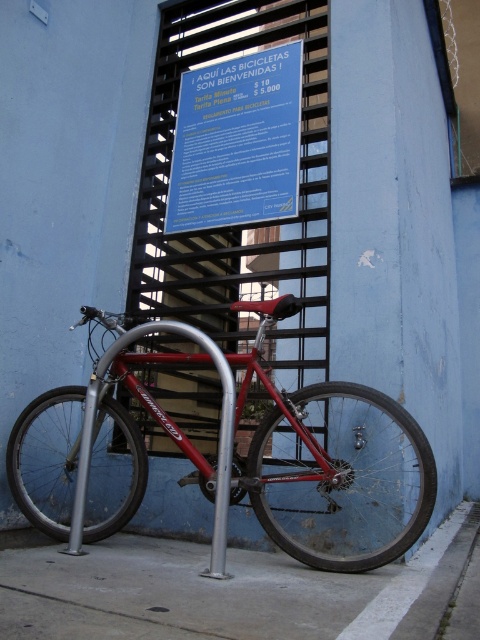
Question: Does gray concrete pavement at lower center have a smaller size compared to blue paper sign at upper center?

Choices:
 (A) no
 (B) yes

Answer: (A)

Question: Which point is closer to the camera?

Choices:
 (A) gray concrete pavement at lower center
 (B) blue paper sign at upper center

Answer: (A)

Question: Is shiny red bicycle at center further to the viewer compared to silver metallic pole at center?

Choices:
 (A) no
 (B) yes

Answer: (A)

Question: Is shiny red bicycle at center bigger than silver metallic pole at center?

Choices:
 (A) yes
 (B) no

Answer: (A)

Question: Which object is closer to the camera taking this photo?

Choices:
 (A) shiny red bicycle at center
 (B) blue paper sign at upper center

Answer: (A)

Question: Which point is farther to the camera?

Choices:
 (A) shiny red bicycle at center
 (B) blue paper sign at upper center

Answer: (B)